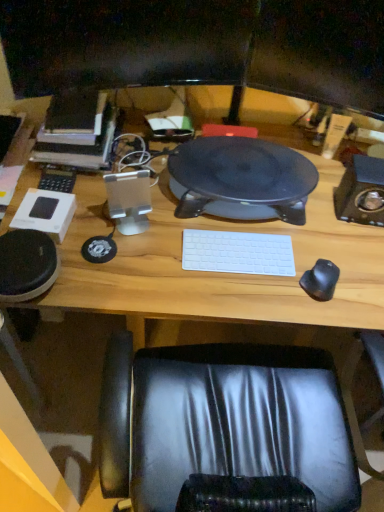
The width and height of the screenshot is (384, 512). I want to click on free space behind black rubber mouse at right, so click(x=319, y=246).